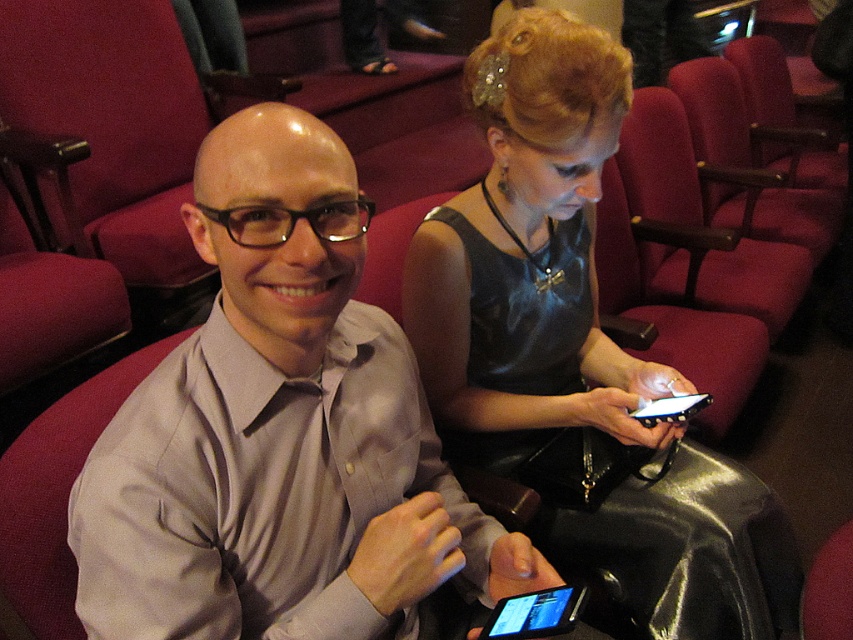
Between gray matte shirt at center and black glossy tablet at lower center, which one has less height?

With less height is black glossy tablet at lower center.

Can you confirm if gray matte shirt at center is smaller than black glossy tablet at lower center?

No, gray matte shirt at center is not smaller than black glossy tablet at lower center.

Is point (105, 588) farther from viewer compared to point (521, 634)?

No, (105, 588) is closer to viewer.

Identify the location of gray matte shirt at center. (281, 433).

Is gray matte shirt at center to the left of shiny black dress at center from the viewer's perspective?

Indeed, gray matte shirt at center is positioned on the left side of shiny black dress at center.

Is gray matte shirt at center closer to camera compared to shiny black dress at center?

Yes, it is in front of shiny black dress at center.

Where is `gray matte shirt at center`? gray matte shirt at center is located at coordinates (281, 433).

At what (x,y) coordinates should I click in order to perform the action: click on gray matte shirt at center. Please return your answer as a coordinate pair (x, y). The width and height of the screenshot is (853, 640). Looking at the image, I should click on (281, 433).

Is shiny black dress at center to the right of black glossy tablet at lower center from the viewer's perspective?

Correct, you'll find shiny black dress at center to the right of black glossy tablet at lower center.

Which is in front, point (671, 618) or point (492, 609)?

Positioned in front is point (492, 609).

In order to click on shiny black dress at center in this screenshot , I will do `click(531, 257)`.